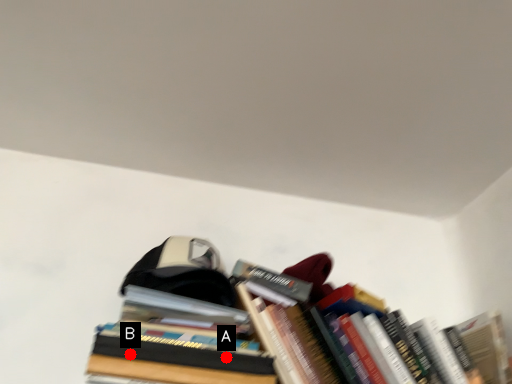
Question: Two points are circled on the image, labeled by A and B beside each circle. Which of the following is the farthest from the observer?

Choices:
 (A) A is further
 (B) B is further

Answer: (A)